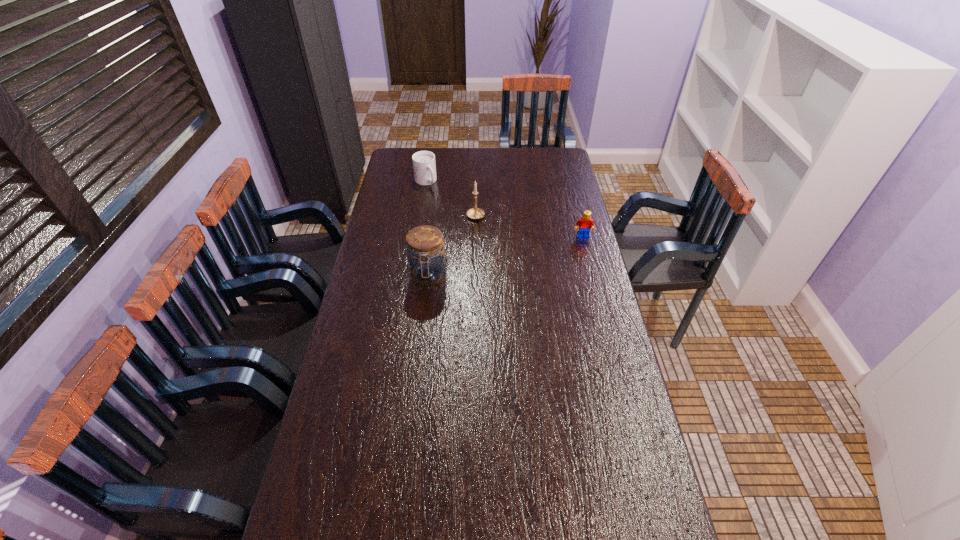
This screenshot has width=960, height=540. What are the coordinates of `vacant space situated 0.320m on the side with the handle of the farthest object` in the screenshot? It's located at [459, 227].

This screenshot has height=540, width=960. Find the location of `vacant point located 0.280m on the handle side of the candle holder`. vacant point located 0.280m on the handle side of the candle holder is located at coordinates (527, 254).

The width and height of the screenshot is (960, 540). I want to click on vacant space located 0.280m on the handle side of the candle holder, so click(527, 254).

At what (x,y) coordinates should I click in order to perform the action: click on vacant space positioned on the handle side of the candle holder. Please return your answer as a coordinate pair (x, y). Looking at the image, I should click on (536, 260).

The width and height of the screenshot is (960, 540). What are the coordinates of `object that is at the left edge` in the screenshot? It's located at (424, 166).

Where is `object that is at the right edge`? The width and height of the screenshot is (960, 540). object that is at the right edge is located at coordinates (585, 223).

Where is `vacant space at the far edge`? This screenshot has width=960, height=540. vacant space at the far edge is located at coordinates (515, 151).

Locate an element on the screen. The height and width of the screenshot is (540, 960). vacant area at the near edge is located at coordinates click(x=551, y=497).

This screenshot has height=540, width=960. I want to click on vacant space at the left edge of the desktop, so click(x=381, y=281).

Where is `free space at the right edge`? free space at the right edge is located at coordinates (618, 416).